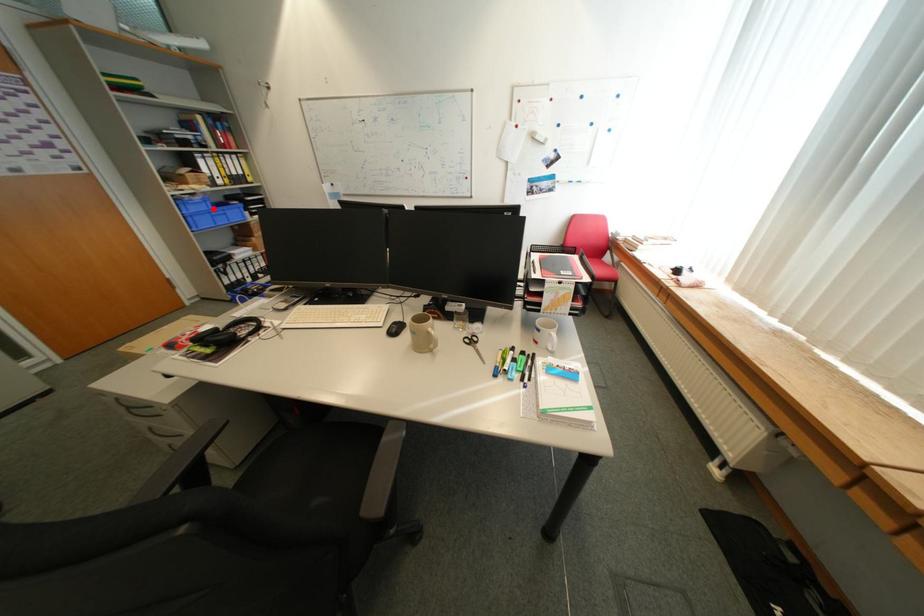
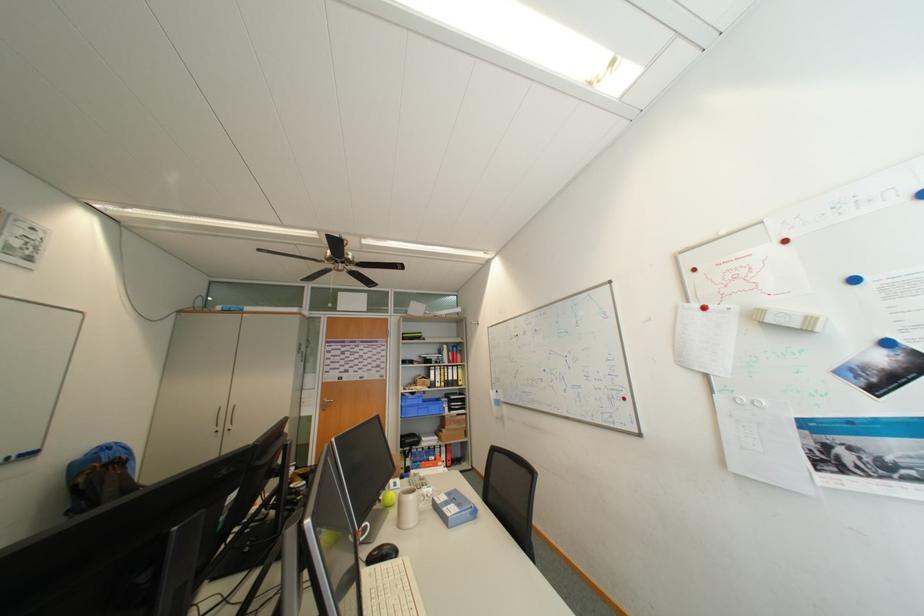
Find the pixel in the second image that matches the highlighted location in the first image.

(426, 403)